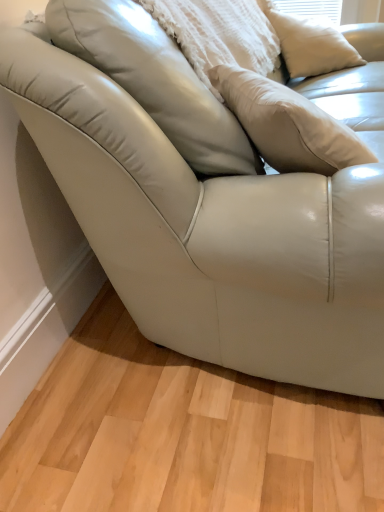
Question: From the image's perspective, is matte white pillow at upper center, the 1th pillow from the left, above or below white matte pillow at upper right, the second pillow in the left-to-right sequence?

Choices:
 (A) above
 (B) below

Answer: (B)

Question: From a real-world perspective, is matte white pillow at upper center, the 1th pillow from the left, positioned above or below white matte pillow at upper right, the first pillow from the right?

Choices:
 (A) above
 (B) below

Answer: (A)

Question: Considering the positions of matte white pillow at upper center, the 1th pillow from the left, and white matte pillow at upper right, the first pillow from the right, in the image, is matte white pillow at upper center, the 1th pillow from the left, wider or thinner than white matte pillow at upper right, the first pillow from the right,?

Choices:
 (A) wide
 (B) thin

Answer: (A)

Question: Is point (327, 18) positioned closer to the camera than point (107, 64)?

Choices:
 (A) closer
 (B) farther

Answer: (B)

Question: Is white matte pillow at upper right, the second pillow in the left-to-right sequence, in front of or behind matte white pillow at upper center, the 1th pillow from the left, in the image?

Choices:
 (A) behind
 (B) front

Answer: (A)

Question: Based on their sizes in the image, would you say white matte pillow at upper right, the first pillow from the right, is bigger or smaller than matte white pillow at upper center, the 1th pillow from the left?

Choices:
 (A) big
 (B) small

Answer: (B)

Question: From a real-world perspective, is white matte pillow at upper right, the first pillow from the right, positioned above or below matte white pillow at upper center, the 1th pillow from the left?

Choices:
 (A) below
 (B) above

Answer: (A)